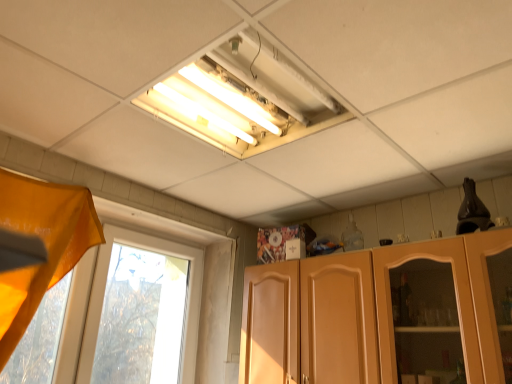
Measure the distance between point (x=440, y=258) and camera.

1.70 meters.

From the picture: What is the approximate height of matte wood cabinet at lower right?

matte wood cabinet at lower right is 62.16 centimeters tall.

Find the location of a particular element. The width and height of the screenshot is (512, 384). orange fabric curtain at left is located at coordinates (45, 246).

Can matte wood cabinet at lower right be found inside transparent glass window at left?

No, matte wood cabinet at lower right is not surrounded by transparent glass window at left.

What's the angular difference between transparent glass window at left and matte wood cabinet at lower right's facing directions?

92.3 degrees.

Would you say transparent glass window at left is a long distance from matte wood cabinet at lower right?

Actually, transparent glass window at left and matte wood cabinet at lower right are a little close together.

Locate an element on the screen. This screenshot has height=384, width=512. cabinetry below the transparent glass window at left (from a real-world perspective) is located at coordinates (382, 314).

Based on the photo, which object is closer to the camera, transparent glass window at left or orange fabric curtain at left?

orange fabric curtain at left.

Which object is wider, transparent glass window at left or orange fabric curtain at left?

orange fabric curtain at left.

In the image, is transparent glass window at left on the left side or the right side of orange fabric curtain at left?

transparent glass window at left is positioned on orange fabric curtain at left's right side.

Are matte wood cabinet at lower right and orange fabric curtain at left beside each other?

matte wood cabinet at lower right and orange fabric curtain at left are not in contact.

Is matte wood cabinet at lower right at the left side of orange fabric curtain at left?

No, matte wood cabinet at lower right is not to the left of orange fabric curtain at left.

From a real-world perspective, is matte wood cabinet at lower right on orange fabric curtain at left?

No, from a real-world perspective, matte wood cabinet at lower right is not above orange fabric curtain at left.

Between orange fabric curtain at left and matte wood cabinet at lower right, which one has larger width?

orange fabric curtain at left is wider.

From a real-world perspective, is orange fabric curtain at left physically below matte wood cabinet at lower right?

No, from a real-world perspective, orange fabric curtain at left is not below matte wood cabinet at lower right.

Between orange fabric curtain at left and matte wood cabinet at lower right, which one appears on the left side from the viewer's perspective?

orange fabric curtain at left is more to the left.

Can you confirm if orange fabric curtain at left is smaller than matte wood cabinet at lower right?

Correct, orange fabric curtain at left occupies less space than matte wood cabinet at lower right.

Does orange fabric curtain at left appear on the right side of transparent glass window at left?

No, orange fabric curtain at left is not to the right of transparent glass window at left.

Is orange fabric curtain at left positioned behind transparent glass window at left?

That is False.

From the picture: In terms of size, does orange fabric curtain at left appear bigger or smaller than transparent glass window at left?

Clearly, orange fabric curtain at left is larger in size than transparent glass window at left.

Is the depth of matte wood cabinet at lower right greater than that of transparent glass window at left?

No, it is in front of transparent glass window at left.

Is matte wood cabinet at lower right taller than transparent glass window at left?

No, matte wood cabinet at lower right is not taller than transparent glass window at left.

From the image's perspective, who appears lower, matte wood cabinet at lower right or transparent glass window at left?

matte wood cabinet at lower right.

The height and width of the screenshot is (384, 512). Identify the location of window positioned vertically above the matte wood cabinet at lower right (from a real-world perspective). (191, 277).

In the image, there is a orange fabric curtain at left. Identify the location of window below it (from the image's perspective). (191, 277).

Based on their spatial positions, is transparent glass window at left or matte wood cabinet at lower right closer to orange fabric curtain at left?

The object closer to orange fabric curtain at left is transparent glass window at left.

When comparing their distances from transparent glass window at left, does orange fabric curtain at left or matte wood cabinet at lower right seem closer?

orange fabric curtain at left.

Estimate the real-world distances between objects in this image. Which object is closer to matte wood cabinet at lower right, orange fabric curtain at left or transparent glass window at left?

Based on the image, transparent glass window at left appears to be nearer to matte wood cabinet at lower right.

Estimate the real-world distances between objects in this image. Which object is closer to transparent glass window at left, matte wood cabinet at lower right or orange fabric curtain at left?

orange fabric curtain at left is closer to transparent glass window at left.

Considering their positions, is matte wood cabinet at lower right positioned closer to orange fabric curtain at left than transparent glass window at left?

Based on the image, transparent glass window at left appears to be nearer to orange fabric curtain at left.

When comparing their distances from matte wood cabinet at lower right, does transparent glass window at left or orange fabric curtain at left seem closer?

transparent glass window at left is closer to matte wood cabinet at lower right.

Find the location of a particular element. The width and height of the screenshot is (512, 384). window located between orange fabric curtain at left and matte wood cabinet at lower right in the left-right direction is located at coordinates (191, 277).